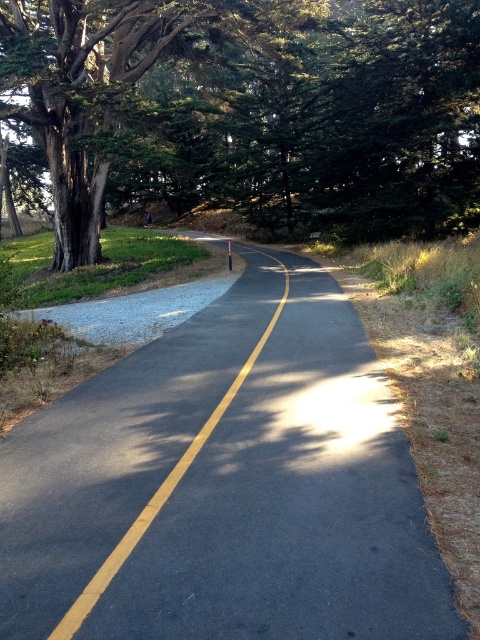
Question: Observing the image, what is the correct spatial positioning of black asphalt road at center in reference to green leafy tree at left?

Choices:
 (A) right
 (B) left

Answer: (A)

Question: Among these points, which one is nearest to the camera?

Choices:
 (A) (75, 403)
 (B) (155, 102)

Answer: (A)

Question: Which point is farther to the camera?

Choices:
 (A) click(x=109, y=394)
 (B) click(x=16, y=97)

Answer: (B)

Question: Does black asphalt road at center have a greater width compared to green leafy tree at left?

Choices:
 (A) no
 (B) yes

Answer: (A)

Question: Can you confirm if black asphalt road at center is thinner than green leafy tree at left?

Choices:
 (A) no
 (B) yes

Answer: (B)

Question: Among these points, which one is farthest from the camera?

Choices:
 (A) (90, 582)
 (B) (383, 10)

Answer: (B)